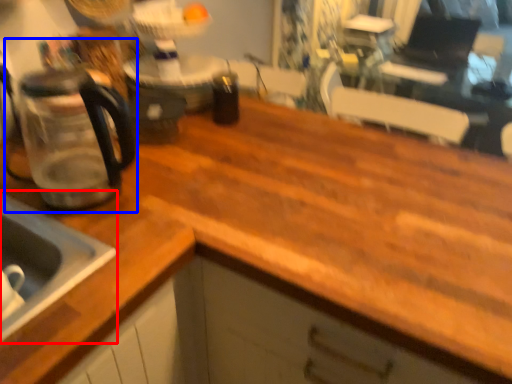
Question: Which object is further to the camera taking this photo, sink (highlighted by a red box) or coffeepot (highlighted by a blue box)?

Choices:
 (A) sink
 (B) coffeepot

Answer: (B)